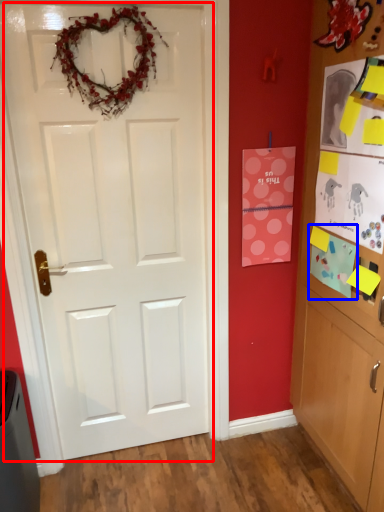
Question: Among these objects, which one is nearest to the camera, door (highlighted by a red box) or postcard (highlighted by a blue box)?

Choices:
 (A) door
 (B) postcard

Answer: (A)